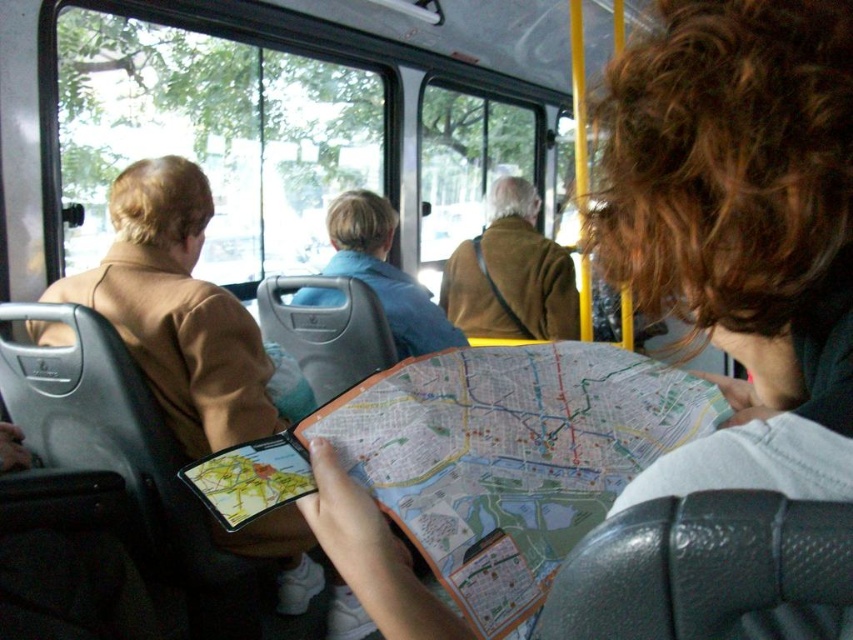
Can you confirm if brown woolen coat at center is bigger than blue cotton shirt at center?

No.

Does brown woolen coat at center have a greater width compared to blue cotton shirt at center?

Incorrect, brown woolen coat at center's width does not surpass blue cotton shirt at center's.

Does point (550, 304) come in front of point (412, 284)?

No, it is not.

Locate an element on the screen. The image size is (853, 640). brown woolen coat at center is located at coordinates tap(511, 275).

Is point (576, 529) positioned behind point (569, 294)?

No, it is not.

From the picture: Who is more forward, (436, 531) or (508, 275)?

Point (436, 531) is more forward.

Locate an element on the screen. The width and height of the screenshot is (853, 640). paper map at center is located at coordinates (509, 456).

Between paper map at center and blue cotton shirt at center, which one has more height?

Standing taller between the two is blue cotton shirt at center.

Is point (473, 484) farther from camera compared to point (413, 278)?

No, it is in front of (413, 278).

Does point (585, 394) come closer to viewer compared to point (334, 228)?

Yes, point (585, 394) is closer to viewer.

The image size is (853, 640). I want to click on paper map at center, so click(x=509, y=456).